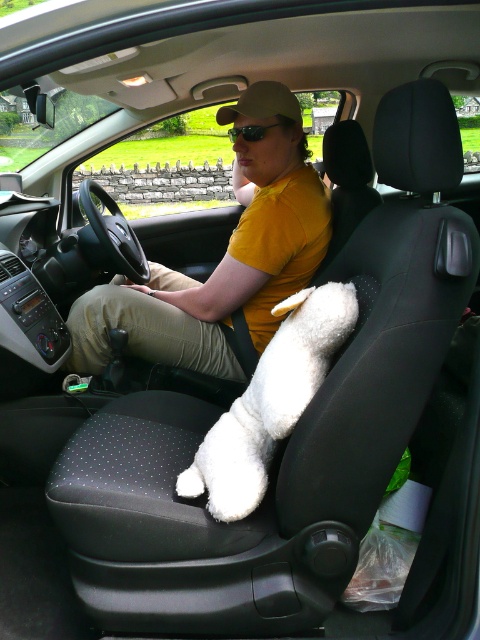
You are a tailor measuring the distance between two items on a mannequin. The items are the khaki fabric pants at center and the green reflective lens glasses at center. The minimum space required for your tools is 30 inches. Can you fit your tools between them?

The khaki fabric pants at center is 32.73 inches from green reflective lens glasses at center. Since the required space is 30 inches, the tools can fit between them.

You are a photographer standing 1.5 meters away from the car window. You want to take a clear photo of the white fluffy dog at center. Can you get a clear shot without moving closer?

The white fluffy dog at center is 1.34 meters away from the camera. Since you are standing 1.5 meters away from the car window, the total distance between you and the dog would be more than 1.34 meters. Therefore, you can take a clear photo without moving closer as long as the window doesn

You are standing at the point marked as point (313, 212) in the car. You want to reach the steering wheel which is 1.2 meters away from you. Can you safely reach it without stretching too far?

The distance between you and the steering wheel is 1.2 meters, which is less than the 2.03 meters between you and the viewer. Since the steering wheel is closer, you can safely reach it without stretching too far.